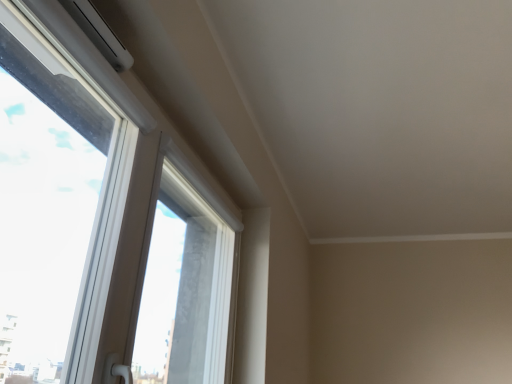
Identify the location of transparent glass window at left. (99, 221).

What do you see at coordinates (99, 221) in the screenshot? I see `transparent glass window at left` at bounding box center [99, 221].

Find the location of a particular element. The height and width of the screenshot is (384, 512). transparent glass window at left is located at coordinates (99, 221).